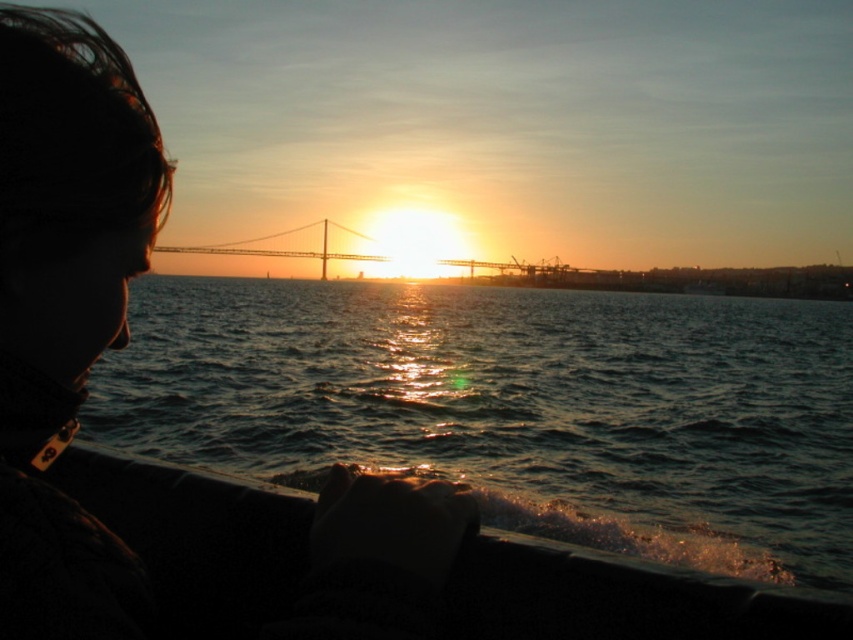
Question: Is glistening water at lower center bigger than metallic bridge at center?

Choices:
 (A) yes
 (B) no

Answer: (A)

Question: Which object is closer to the camera taking this photo?

Choices:
 (A) glistening water at lower center
 (B) metallic bridge at center

Answer: (A)

Question: Which point is closer to the camera taking this photo?

Choices:
 (A) (234, 243)
 (B) (440, 330)

Answer: (B)

Question: Is glistening water at lower center to the right of metallic bridge at center from the viewer's perspective?

Choices:
 (A) no
 (B) yes

Answer: (B)

Question: Can you confirm if glistening water at lower center is positioned to the right of metallic bridge at center?

Choices:
 (A) yes
 (B) no

Answer: (A)